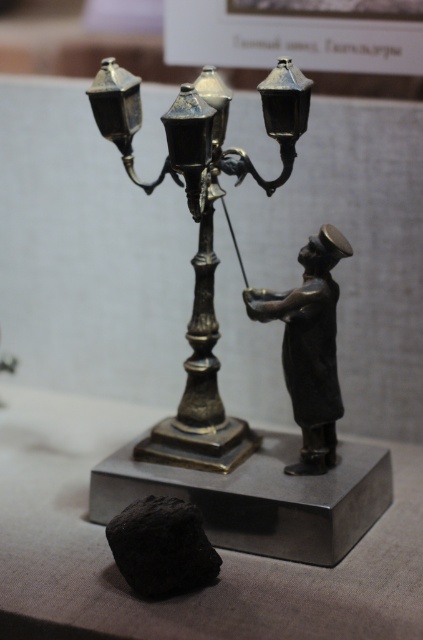
You are an art curator examining the miniature bronze sculpture and the dark irregular object in the scene. Where is the bronze figurine at right located in relation to the dark irregular object?

The bronze figurine at right is located at the coordinates point [310,346] in the scene.

What are the coordinates of the polished brass lamp at center?

The coordinates of the polished brass lamp at center are at point (x=200, y=232).

You are a museum visitor standing in front of the sculpture display. You want to take a closer look at the black matte rock at lower left without moving the bronze figurine at right. Is the rock accessible from your current position?

The bronze figurine at right is further to the viewer than the black matte rock at lower left, so the rock is behind the figurine. Therefore, you cannot access the black matte rock at lower left directly without moving the bronze figurine at right.